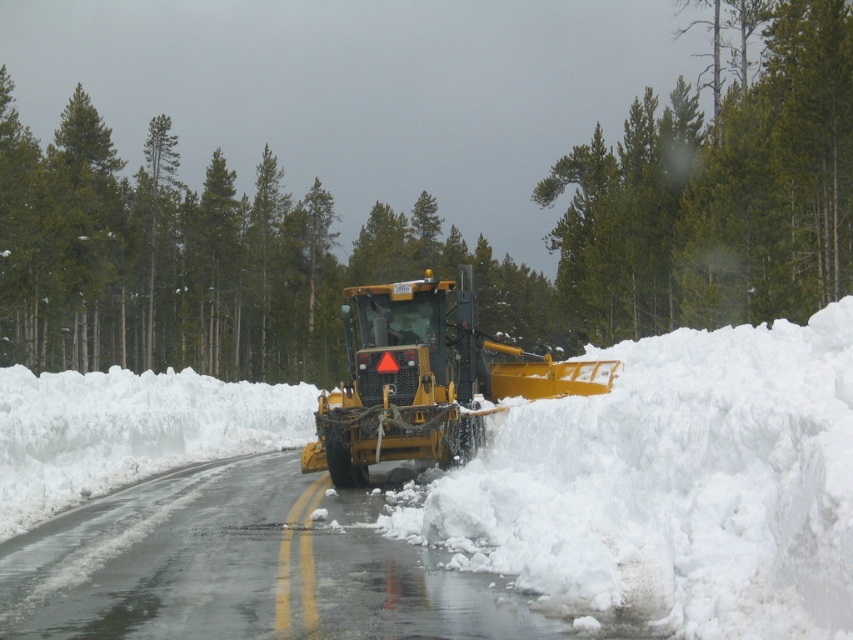
Question: Which object is closer to the camera taking this photo?

Choices:
 (A) green textured pine at upper center
 (B) yellow metallic plow at center

Answer: (B)

Question: Can you confirm if white fluffy snow at center is positioned above yellow metallic plow at center?

Choices:
 (A) no
 (B) yes

Answer: (A)

Question: Does yellow rubber snowplow at center have a smaller size compared to yellow metallic plow at center?

Choices:
 (A) yes
 (B) no

Answer: (A)

Question: Among these points, which one is nearest to the camera?

Choices:
 (A) (340, 387)
 (B) (167, 620)
 (C) (820, 305)

Answer: (B)

Question: Which of the following is the closest to the observer?

Choices:
 (A) (537, 355)
 (B) (299, 291)
 (C) (579, 147)
 (D) (160, 637)

Answer: (D)

Question: Is green textured pine at center to the right of yellow rubber snowplow at center from the viewer's perspective?

Choices:
 (A) no
 (B) yes

Answer: (A)